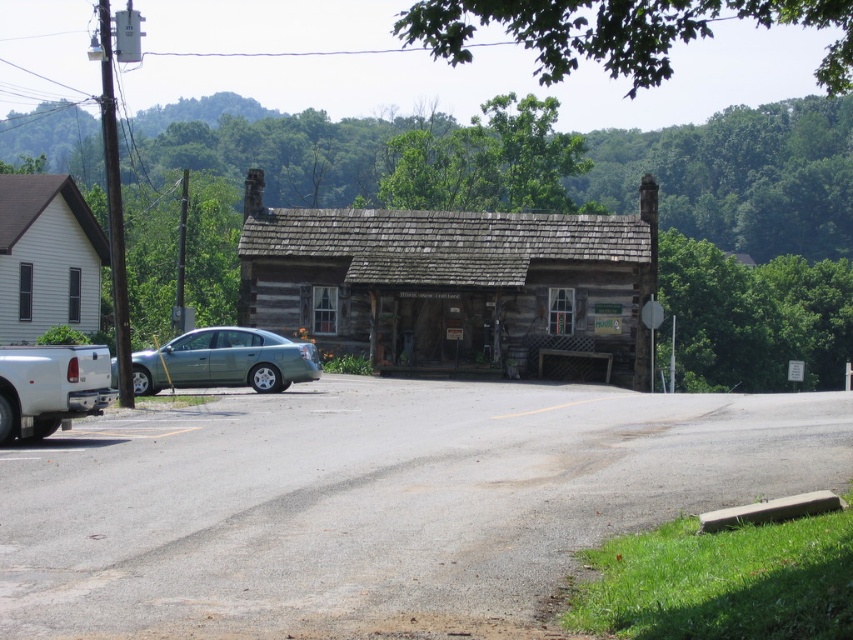
You are standing at the intersection of the road and the cabin driveway. Which direction should you go to reach the weathered wood log cabin at center?

The weathered wood log cabin at center is located at point coordinates, so you should head towards the cabin by moving towards the coordinates provided.

You are standing at the cabin and want to walk to the road. Which point, point (44, 301) or point (241, 340), is closer to you?

Point (44, 301) is closer to you because it is further to the camera than point (241, 340), meaning it is physically nearer in the scene.